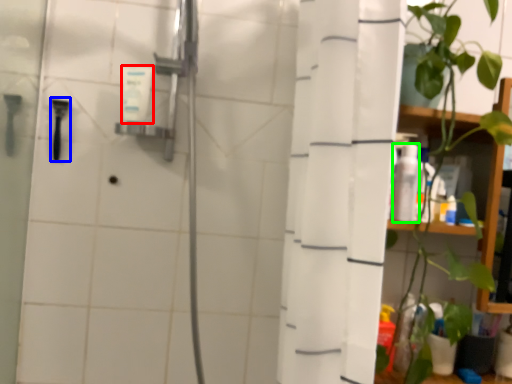
Question: Estimate the real-world distances between objects in this image. Which object is farther from toiletry (highlighted by a red box), shower (highlighted by a blue box) or toiletry (highlighted by a green box)?

Choices:
 (A) shower
 (B) toiletry

Answer: (B)